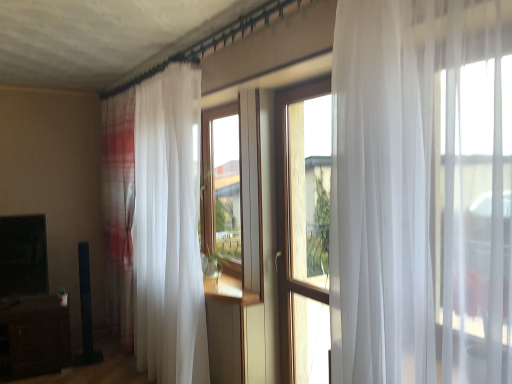
Image resolution: width=512 pixels, height=384 pixels. I want to click on white sheer curtain at left, so click(156, 224).

At what (x,y) coordinates should I click in order to perform the action: click on curtain above the brown wood entertainment center at lower left (from the image's perspective). Please return your answer as a coordinate pair (x, y). Looking at the image, I should click on (156, 224).

Looking at this image, is white sheer curtain at left inside brown wood entertainment center at lower left?

No, white sheer curtain at left is located outside of brown wood entertainment center at lower left.

From a real-world perspective, is brown wood entertainment center at lower left above or below white sheer curtain at left?

Clearly, from a real-world perspective, brown wood entertainment center at lower left is below white sheer curtain at left.

Based on the photo, is brown wood entertainment center at lower left facing towards white sheer curtain at left?

No.

From the image's perspective, which one is positioned higher, brown wood entertainment center at lower left or wooden window at center?

wooden window at center, from the image's perspective.

How far apart are brown wood entertainment center at lower left and wooden window at center?

2.21 meters.

Between brown wood entertainment center at lower left and wooden window at center, which one has larger width?

Wider between the two is brown wood entertainment center at lower left.

From a real-world perspective, does brown wood entertainment center at lower left sit lower than wooden window at center?

Indeed, from a real-world perspective, brown wood entertainment center at lower left is positioned beneath wooden window at center.

Is white sheer curtain at left spatially inside brown wood entertainment center at lower left, or outside of it?

white sheer curtain at left cannot be found inside brown wood entertainment center at lower left.

Between white sheer curtain at left and brown wood entertainment center at lower left, which one has larger size?

white sheer curtain at left is bigger.

Does white sheer curtain at left appear on the right side of brown wood entertainment center at lower left?

Indeed, white sheer curtain at left is positioned on the right side of brown wood entertainment center at lower left.

Is the position of white sheer curtain at left more distant than that of brown wood entertainment center at lower left?

That is False.

Is the depth of wooden window at center greater than that of white sheer curtain at left?

No, the depth of wooden window at center is less than that of white sheer curtain at left.

Is wooden window at center facing towards white sheer curtain at left?

No.

Locate an element on the screen. The width and height of the screenshot is (512, 384). window below the white sheer curtain at left (from the image's perspective) is located at coordinates (288, 214).

Is white sheer curtain at left completely or partially outside of wooden window at center?

Yes, white sheer curtain at left is outside of wooden window at center.

Based on their sizes in the image, would you say white sheer curtain at left is bigger or smaller than wooden window at center?

In the image, white sheer curtain at left appears to be larger than wooden window at center.

Locate an element on the screen. window below the white sheer curtain at left (from a real-world perspective) is located at coordinates (288, 214).

Does point (286, 241) come farther from viewer compared to point (60, 329)?

No.

In the scene shown: How many degrees apart are the facing directions of wooden window at center and brown wood entertainment center at lower left?

There is a 81.1-degree angle between the facing directions of wooden window at center and brown wood entertainment center at lower left.

Can you confirm if wooden window at center is smaller than brown wood entertainment center at lower left?

Indeed, wooden window at center has a smaller size compared to brown wood entertainment center at lower left.

Choose the correct answer: Is wooden window at center inside brown wood entertainment center at lower left or outside it?

wooden window at center is not enclosed by brown wood entertainment center at lower left.

Locate an element on the screen. Image resolution: width=512 pixels, height=384 pixels. curtain above the brown wood entertainment center at lower left (from a real-world perspective) is located at coordinates (156, 224).

Identify the location of entertainment center located underneath the wooden window at center (from a real-world perspective). (29, 303).

Based on their spatial positions, is wooden window at center or brown wood entertainment center at lower left closer to white sheer curtain at left?

Based on the image, brown wood entertainment center at lower left appears to be nearer to white sheer curtain at left.

Estimate the real-world distances between objects in this image. Which object is closer to wooden window at center, white sheer curtain at left or brown wood entertainment center at lower left?

white sheer curtain at left.

From the picture: Looking at the image, which one is located closer to white sheer curtain at left, brown wood entertainment center at lower left or wooden window at center?

brown wood entertainment center at lower left is closer to white sheer curtain at left.

Estimate the real-world distances between objects in this image. Which object is closer to brown wood entertainment center at lower left, wooden window at center or white sheer curtain at left?

Among the two, white sheer curtain at left is located nearer to brown wood entertainment center at lower left.

Considering their positions, is white sheer curtain at left positioned closer to brown wood entertainment center at lower left than wooden window at center?

The object closer to brown wood entertainment center at lower left is white sheer curtain at left.

When comparing their distances from wooden window at center, does brown wood entertainment center at lower left or white sheer curtain at left seem further?

brown wood entertainment center at lower left is positioned further to the anchor wooden window at center.

At what (x,y) coordinates should I click in order to perform the action: click on curtain located between brown wood entertainment center at lower left and wooden window at center in the left-right direction. Please return your answer as a coordinate pair (x, y). The height and width of the screenshot is (384, 512). Looking at the image, I should click on (156, 224).